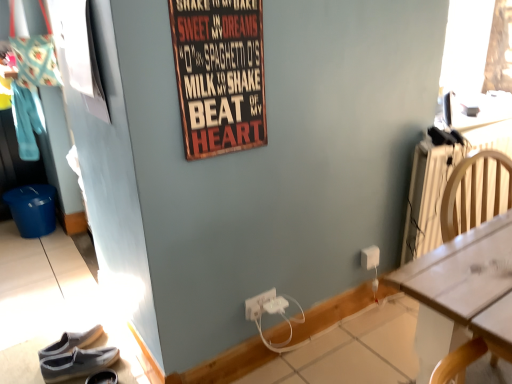
Question: Is wooden signboard at upper center bigger than white plastic power outlet at lower center, the first power outlet when ordered from front to back?

Choices:
 (A) yes
 (B) no

Answer: (A)

Question: Is white plastic power outlet at lower center, the third power outlet in the back-to-front sequence, located within wooden signboard at upper center?

Choices:
 (A) yes
 (B) no

Answer: (B)

Question: Is wooden signboard at upper center far from white plastic power outlet at lower center, the third power outlet in the back-to-front sequence?

Choices:
 (A) no
 (B) yes

Answer: (A)

Question: Does wooden signboard at upper center have a lesser height compared to white plastic power outlet at lower center, the first power outlet when ordered from front to back?

Choices:
 (A) no
 (B) yes

Answer: (A)

Question: From a real-world perspective, is wooden signboard at upper center physically above white plastic power outlet at lower center, the first power outlet when ordered from front to back?

Choices:
 (A) yes
 (B) no

Answer: (A)

Question: Is white wood desk at right spatially inside gray fabric shoe at lower left, the 2th footwear in the left-to-right sequence, or outside of it?

Choices:
 (A) outside
 (B) inside

Answer: (A)

Question: From their relative heights in the image, would you say white wood desk at right is taller or shorter than gray fabric shoe at lower left, the first footwear viewed from the right?

Choices:
 (A) tall
 (B) short

Answer: (A)

Question: Considering the positions of point click(x=478, y=317) and point click(x=108, y=379), is point click(x=478, y=317) closer or farther from the camera than point click(x=108, y=379)?

Choices:
 (A) farther
 (B) closer

Answer: (B)

Question: From the image's perspective, relative to gray fabric shoe at lower left, the 2th footwear in the left-to-right sequence, is white wood desk at right above or below?

Choices:
 (A) above
 (B) below

Answer: (A)

Question: Considering their positions, is white plastic power outlet at lower center, arranged as the 2th power outlet when viewed from the back, located in front of or behind wooden signboard at upper center?

Choices:
 (A) behind
 (B) front

Answer: (A)

Question: Considering the positions of white plastic power outlet at lower center, placed as the second power outlet when sorted from front to back, and wooden signboard at upper center in the image, is white plastic power outlet at lower center, placed as the second power outlet when sorted from front to back, bigger or smaller than wooden signboard at upper center?

Choices:
 (A) big
 (B) small

Answer: (B)

Question: Is white plastic power outlet at lower center, the first power outlet viewed from the left, spatially inside wooden signboard at upper center, or outside of it?

Choices:
 (A) inside
 (B) outside

Answer: (B)

Question: From the image's perspective, relative to wooden signboard at upper center, is white plastic power outlet at lower center, arranged as the 2th power outlet when viewed from the back, above or below?

Choices:
 (A) below
 (B) above

Answer: (A)

Question: From a real-world perspective, is white plastic power outlet at lower center, the third power outlet in the back-to-front sequence, physically located above or below white plastic power outlet at lower right, marked as the third power outlet in a left-to-right arrangement?

Choices:
 (A) above
 (B) below

Answer: (B)

Question: Would you say white plastic power outlet at lower center, the third power outlet in the back-to-front sequence, is to the left or to the right of white plastic power outlet at lower right, acting as the first power outlet starting from the back, in the picture?

Choices:
 (A) left
 (B) right

Answer: (A)